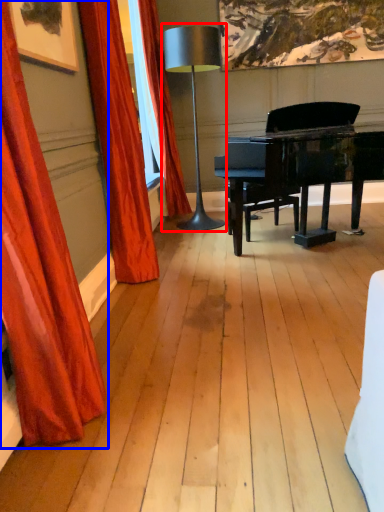
Question: Which object appears farthest to the camera in this image, table lamp (highlighted by a red box) or curtain (highlighted by a blue box)?

Choices:
 (A) table lamp
 (B) curtain

Answer: (A)